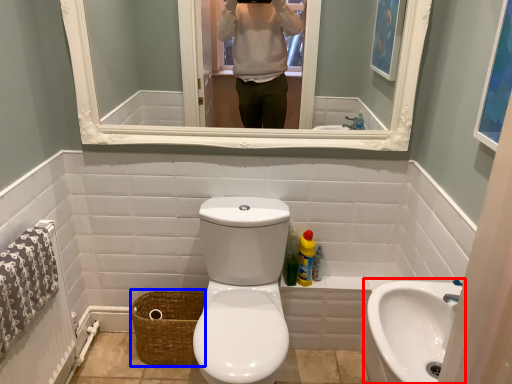
Question: Among these objects, which one is farthest to the camera, sink (highlighted by a red box) or basket (highlighted by a blue box)?

Choices:
 (A) sink
 (B) basket

Answer: (B)